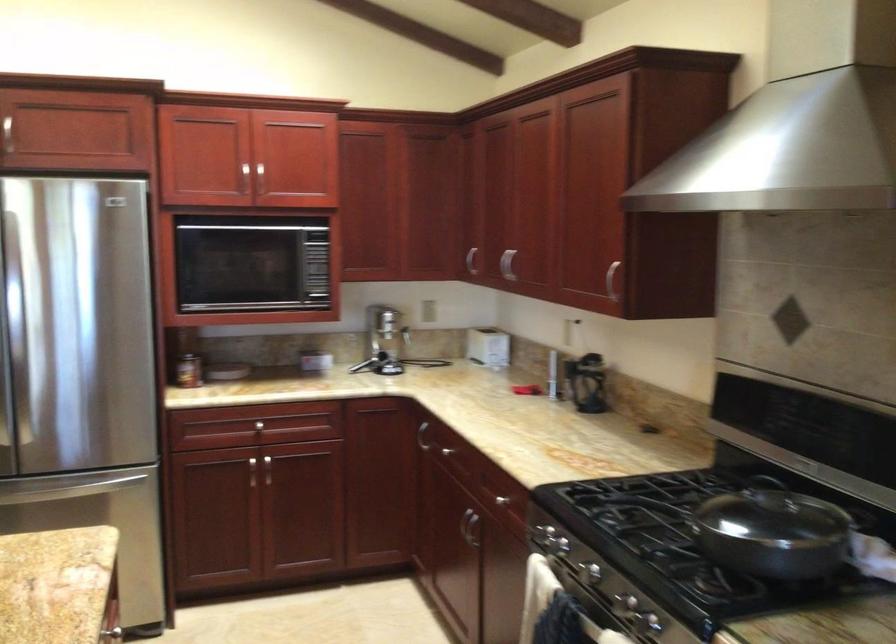
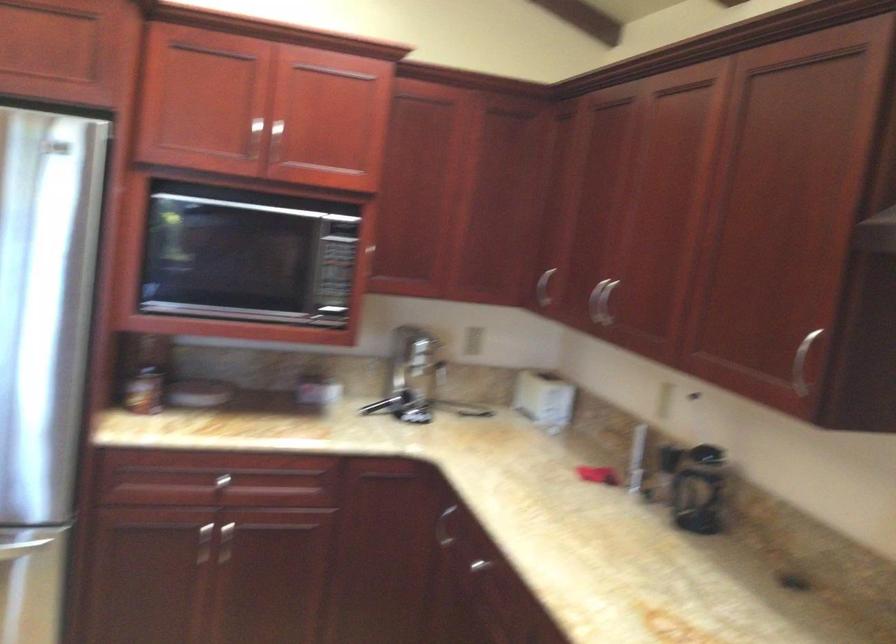
Where in the second image is the point corresponding to (x=420, y=439) from the first image?

(444, 527)